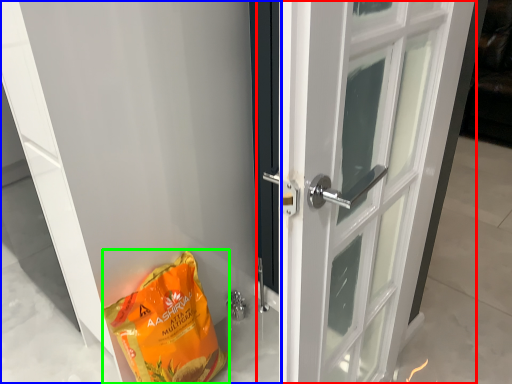
Question: Which object is the farthest from door (highlighted by a red box)? Choose among these: door (highlighted by a blue box) or grocery bag (highlighted by a green box).

Choices:
 (A) door
 (B) grocery bag

Answer: (B)